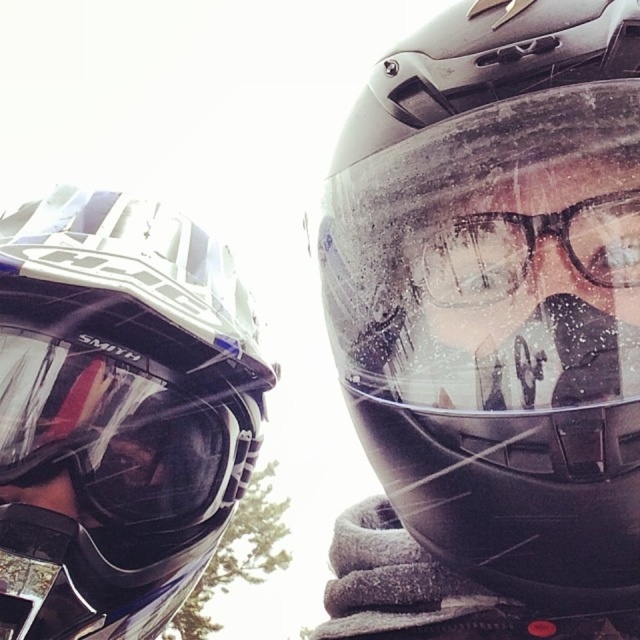
You are a photographer trying to capture both the matte black helmet at center and the transparent plastic glasses at center in a single shot. Since your camera has a limited field of view, you need to position yourself so that both objects are visible. Based on their positions, should you move to the left or right to include both in the frame?

The matte black helmet at center is to the left of the transparent plastic glasses at center, so you should move to the right to include both in the frame.

You are a photographer trying to capture both the matte black helmet at center and the matte black helmet at upper left in a single shot. Based on their positions, which helmet will appear larger in the photo?

The matte black helmet at center will appear larger in the photo because it is positioned in front of the matte black helmet at upper left, making it closer to the camera.

You are a photographer setting up equipment. You have a matte black helmet at upper left and transparent plastic glasses at center in your frame. Which object is positioned higher in the image?

The matte black helmet at upper left is positioned higher in the image than the transparent plastic glasses at center because it is much taller as stated in the description.